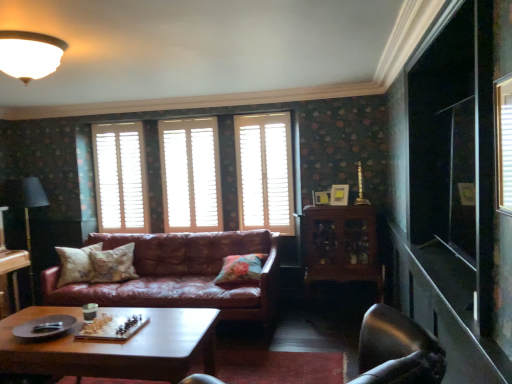
Question: From a real-world perspective, is shiny brown wood coffee table at center beneath metallic silver swivel chair at lower right?

Choices:
 (A) no
 (B) yes

Answer: (B)

Question: Is shiny brown wood coffee table at center facing towards metallic silver swivel chair at lower right?

Choices:
 (A) no
 (B) yes

Answer: (A)

Question: From the image's perspective, is shiny brown wood coffee table at center on metallic silver swivel chair at lower right?

Choices:
 (A) yes
 (B) no

Answer: (B)

Question: Does shiny brown wood coffee table at center lie in front of metallic silver swivel chair at lower right?

Choices:
 (A) no
 (B) yes

Answer: (A)

Question: Can you confirm if shiny brown wood coffee table at center is bigger than metallic silver swivel chair at lower right?

Choices:
 (A) no
 (B) yes

Answer: (B)

Question: Can you confirm if shiny brown wood coffee table at center is taller than metallic silver swivel chair at lower right?

Choices:
 (A) no
 (B) yes

Answer: (B)

Question: Is fluffy beige pillow at center, marked as the second pillow in a right-to-left arrangement, completely or partially outside of white wooden shutters at center, placed as the first window when sorted from right to left?

Choices:
 (A) yes
 (B) no

Answer: (A)

Question: From the image's perspective, is fluffy beige pillow at center, marked as the second pillow in a right-to-left arrangement, below white wooden shutters at center, arranged as the 3th window when viewed from the left?

Choices:
 (A) no
 (B) yes

Answer: (B)

Question: Does fluffy beige pillow at center, the 2th pillow from the left, have a greater width compared to white wooden shutters at center, arranged as the 3th window when viewed from the left?

Choices:
 (A) yes
 (B) no

Answer: (A)

Question: Considering the relative positions of fluffy beige pillow at center, marked as the second pillow in a right-to-left arrangement, and white wooden shutters at center, arranged as the 3th window when viewed from the left, in the image provided, is fluffy beige pillow at center, marked as the second pillow in a right-to-left arrangement, to the right of white wooden shutters at center, arranged as the 3th window when viewed from the left, from the viewer's perspective?

Choices:
 (A) no
 (B) yes

Answer: (A)

Question: From a real-world perspective, is fluffy beige pillow at center, the 2th pillow from the left, positioned under white wooden shutters at center, placed as the first window when sorted from right to left, based on gravity?

Choices:
 (A) no
 (B) yes

Answer: (B)

Question: Is fluffy beige pillow at center, marked as the second pillow in a right-to-left arrangement, thinner than white wooden shutters at center, arranged as the 3th window when viewed from the left?

Choices:
 (A) yes
 (B) no

Answer: (B)

Question: From a real-world perspective, is fluffy beige pillow at center, the 2th pillow from the left, physically above black fabric lamp at left?

Choices:
 (A) yes
 (B) no

Answer: (B)